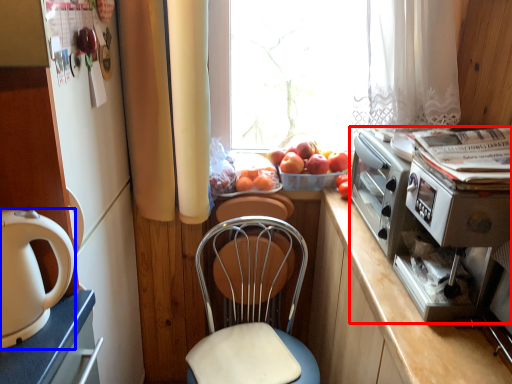
Question: Among these objects, which one is farthest to the camera, appliance (highlighted by a red box) or home appliance (highlighted by a blue box)?

Choices:
 (A) appliance
 (B) home appliance

Answer: (A)